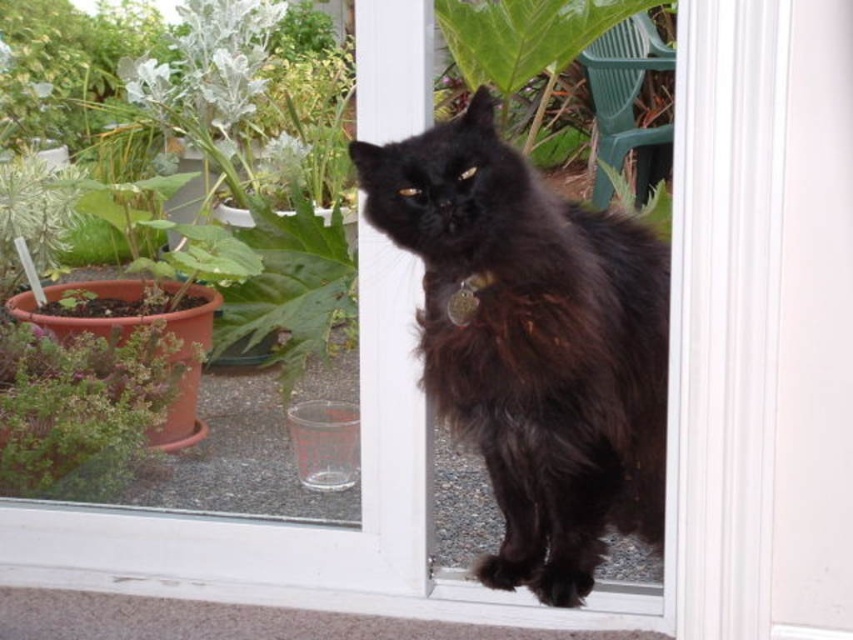
You are a delivery person trying to reach the doorbell. The black fluffy cat at center is blocking your path to the doorbell located near the green matte plant at left. Can you go around the cat to reach the doorbell?

The black fluffy cat at center is in front of the green matte plant at left, so you can go around the cat to reach the doorbell as long as there is space on either side of the cat.

You are a delivery person holding a box that is 5 feet long. You need to bring the box through the white smooth screen door at center. Can you fit the box through the door without tilting it?

The white smooth screen door at center is 4.56 feet from camera. Since the box is 5 feet long, which is longer than the distance from the camera to the door, it might not fit through the door without tilting it. However, the description only provides the distance from the camera to the door, not the door width. Therefore, we cannot determine if the box will fit based on the given information.

You are a delivery person trying to enter through the white smooth screen door at center. However, you notice a black fluffy cat at center blocking the entrance. Can you pass through the door without disturbing the cat?

The white smooth screen door at center is narrower than the black fluffy cat at center, so the cat is blocking the entrance entirely. You cannot pass through the door without moving the cat.